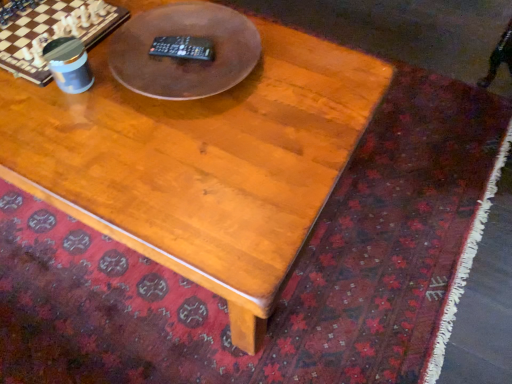
Question: From the image's perspective, is wooden coffee table at center positioned above or below brown wooden table at center?

Choices:
 (A) above
 (B) below

Answer: (B)

Question: From a real-world perspective, is wooden coffee table at center physically located above or below brown wooden table at center?

Choices:
 (A) above
 (B) below

Answer: (B)

Question: Considering the positions of wooden coffee table at center and brown wooden table at center in the image, is wooden coffee table at center wider or thinner than brown wooden table at center?

Choices:
 (A) thin
 (B) wide

Answer: (B)

Question: Do you think brown wooden table at center is within wooden coffee table at center, or outside of it?

Choices:
 (A) inside
 (B) outside

Answer: (B)

Question: In the image, is brown wooden table at center on the left side or the right side of wooden coffee table at center?

Choices:
 (A) right
 (B) left

Answer: (A)

Question: Considering the positions of point (140, 49) and point (322, 94), is point (140, 49) closer or farther from the camera than point (322, 94)?

Choices:
 (A) closer
 (B) farther

Answer: (B)

Question: Looking at the image, does brown wooden table at center seem bigger or smaller compared to wooden coffee table at center?

Choices:
 (A) big
 (B) small

Answer: (B)